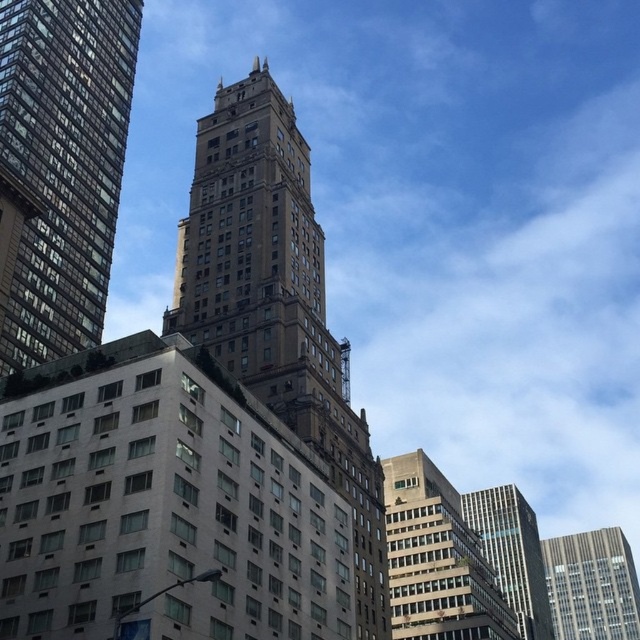
Is the position of gray concrete building at center less distant than that of glassy reflective skyscraper at center?

Yes, it is in front of glassy reflective skyscraper at center.

Between gray concrete building at center and glassy reflective skyscraper at center, which one appears on the left side from the viewer's perspective?

gray concrete building at center is more to the left.

Does point (432, 534) come farther from viewer compared to point (531, 580)?

No, (432, 534) is in front of (531, 580).

Find the location of a particular element. The image size is (640, 640). gray concrete building at center is located at coordinates (436, 560).

Does gray concrete building at center have a smaller size compared to gray concrete skyscraper at center?

Yes.

The height and width of the screenshot is (640, 640). Describe the element at coordinates (436, 560) in the screenshot. I see `gray concrete building at center` at that location.

This screenshot has height=640, width=640. I want to click on gray concrete building at center, so click(x=436, y=560).

Does brown stone tower at upper left appear under gray concrete skyscraper at center?

Actually, brown stone tower at upper left is above gray concrete skyscraper at center.

Which of these two, brown stone tower at upper left or gray concrete skyscraper at center, stands shorter?

Standing shorter between the two is gray concrete skyscraper at center.

Who is more distant from viewer, (93,86) or (576,620)?

Point (576,620)

Locate an element on the screen. brown stone tower at upper left is located at coordinates (60, 168).